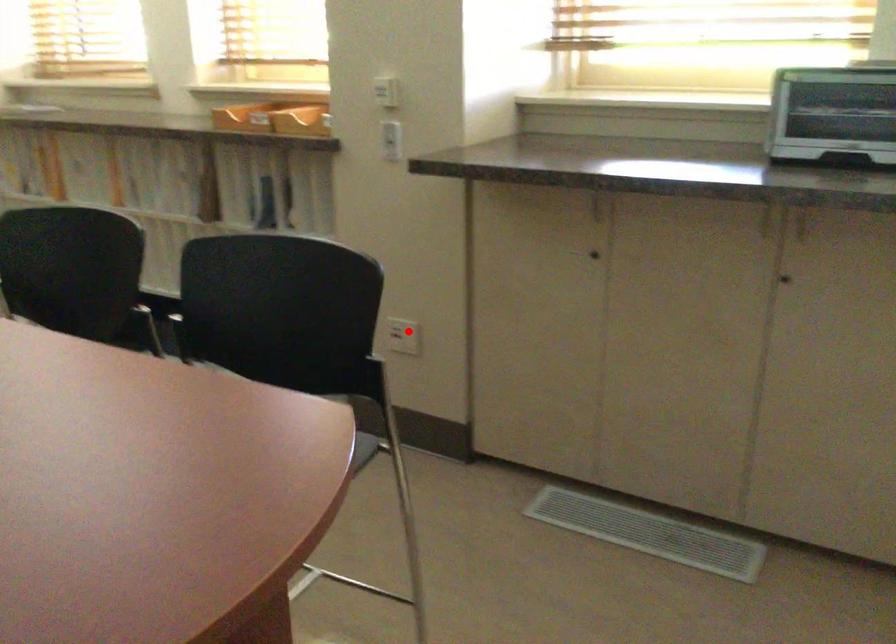
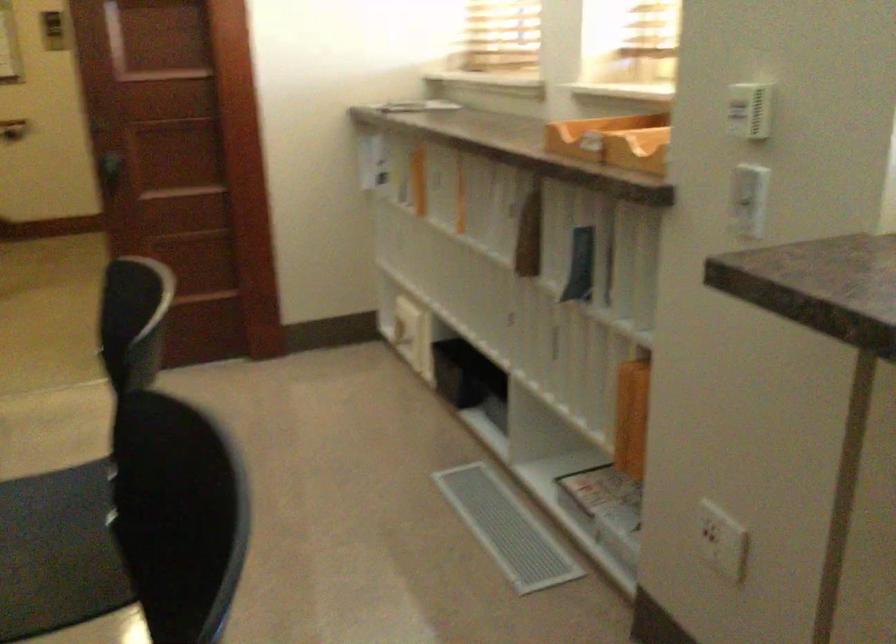
The point at the highlighted location is marked in the first image. Where is the corresponding point in the second image?

(721, 541)